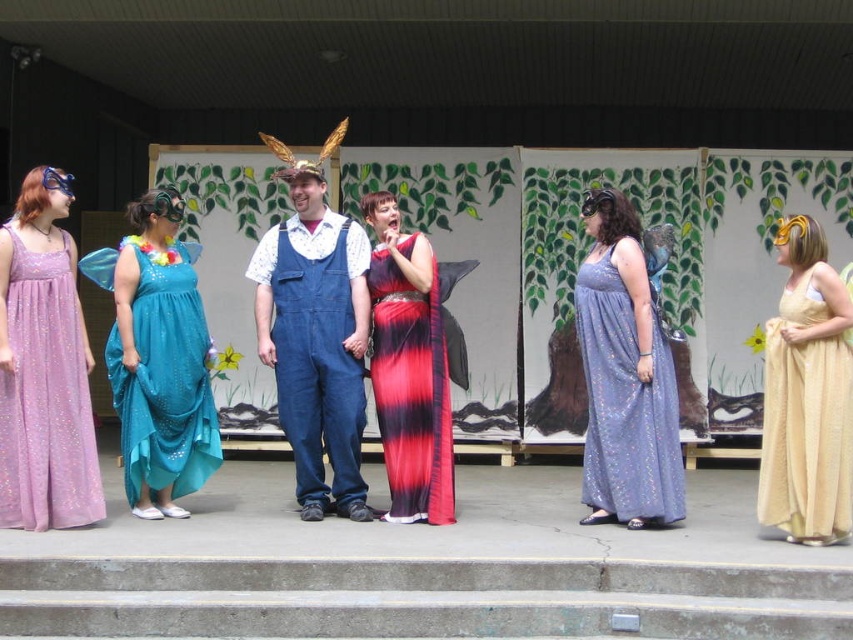
You are a photographer positioned at the center of the stage. You want to capture a photo that includes the teal sequined dress at left and the green leaves in the backdrop. Which direction should you move to ensure both are in frame?

Since the teal sequined dress at left is located at point (164, 380), moving slightly to the right would center the dress while keeping the backdrop visible.

You are a stagehand setting up a temporary platform that needs to be placed between the concrete stairs at lower center and the denim overalls at center. The platform must be higher than both objects. Is this possible?

The concrete stairs at lower center is shorter than the denim overalls at center. Since the platform must be higher than both, it would need to be taller than the taller object, which is the denim overalls at center. Therefore, it is possible as long as the platform exceeds the height of the denim overalls at center.

You are standing 5 meters away from the stage. Can you clearly see the details of the blue mask with a decorative headband worn by the leftmost individual? The mask is located at point (178, 621).

The distance between the viewer and point (178, 621) is 5.72 meters. Since you are only 5 meters away from the stage, you are closer than the mask, so you can clearly see the details of the blue mask with a decorative headband worn by the leftmost individual.